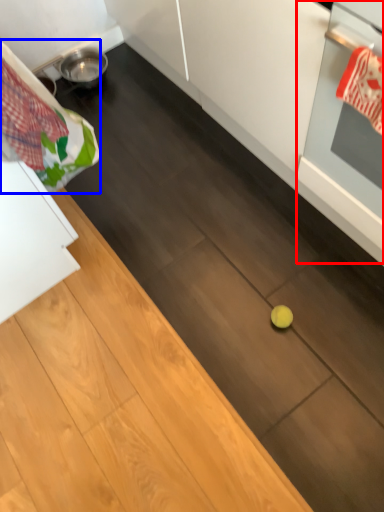
Question: Which of the following is the farthest to the observer, oven (highlighted by a red box) or laundry (highlighted by a blue box)?

Choices:
 (A) oven
 (B) laundry

Answer: (B)